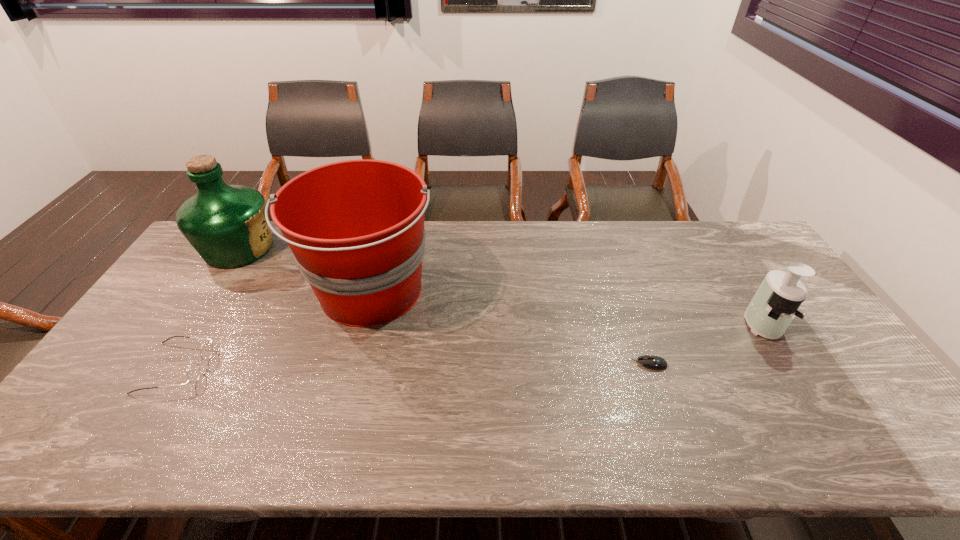
In order to click on vacant space at the right edge in this screenshot , I will do `click(753, 264)`.

Where is `vacant space at the near left corner of the desktop`? vacant space at the near left corner of the desktop is located at coordinates (61, 459).

Identify the location of vacant space at the far right corner. (729, 227).

This screenshot has width=960, height=540. Find the location of `free space that is in between the fourth tallest object and the shortest object`. free space that is in between the fourth tallest object and the shortest object is located at coordinates (413, 366).

I want to click on empty space between the computer mouse and the fourth tallest object, so click(x=413, y=366).

At what (x,y) coordinates should I click in order to perform the action: click on free space between the third shortest object and the shortest object. Please return your answer as a coordinate pair (x, y). Image resolution: width=960 pixels, height=540 pixels. Looking at the image, I should click on (706, 344).

At what (x,y) coordinates should I click in order to perform the action: click on free point between the third tallest object and the second object from right to left. Please return your answer as a coordinate pair (x, y). Image resolution: width=960 pixels, height=540 pixels. Looking at the image, I should click on (706, 344).

Where is `free spot between the spectacles and the liquor`? This screenshot has height=540, width=960. free spot between the spectacles and the liquor is located at coordinates (207, 308).

In order to click on free area in between the liquor and the shortest object in this screenshot , I will do `click(444, 306)`.

Locate an element on the screen. This screenshot has width=960, height=540. unoccupied area between the liquor and the spectacles is located at coordinates (207, 308).